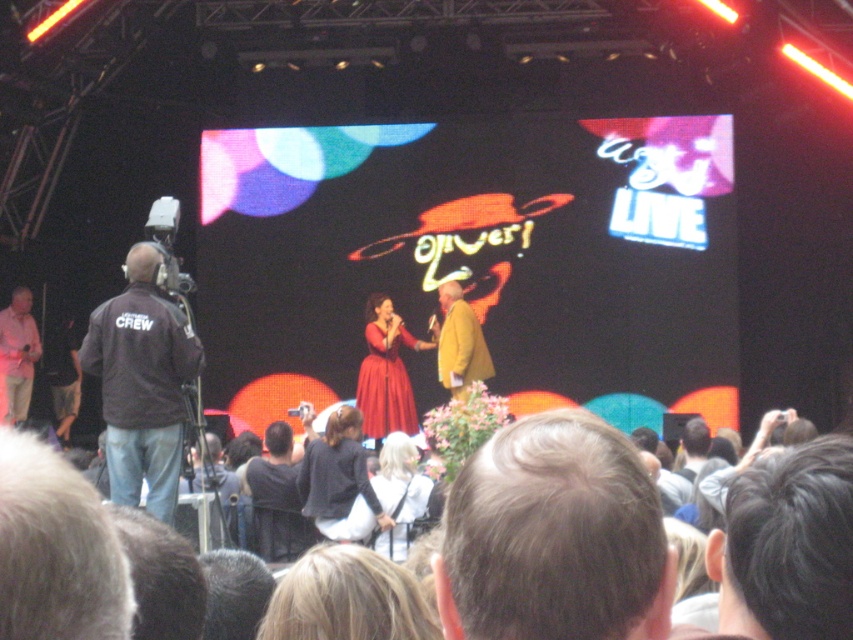
You are a photographer standing at the edge of the stage. You want to capture a closeup shot of the matte black dress at center. Given that your camera has a maximum focus range of 60 meters, will you be able to focus on the dress?

The matte black dress at center and viewer are 69.40 meters apart from each other. Since the camera can only focus up to 60 meters, it cannot focus on the dress as it is beyond the maximum range.

You are a photographer positioned at the back of the stage. You want to take a photo of both the white matte dress at center and the yellow textured coat at center without any obstruction. Based on their positions, which one should you focus on first to ensure both are visible?

The white matte dress at center is in front of the yellow textured coat at center. To ensure both are visible, focus on the yellow textured coat at center first, as it is behind the white matte dress at center and might be partially obscured otherwise.